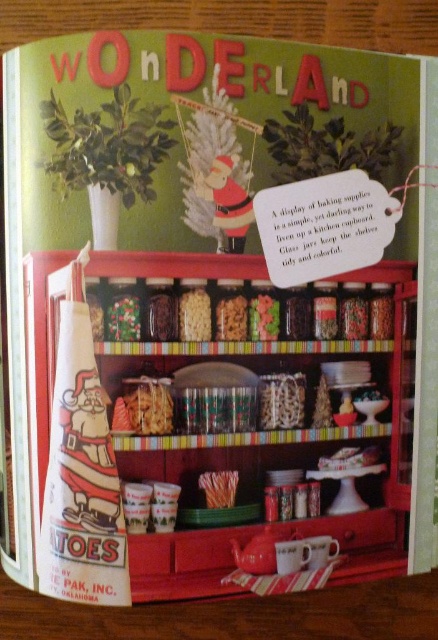
Question: Is matte glass jars at center to the left of wooden table at lower center from the viewer's perspective?

Choices:
 (A) yes
 (B) no

Answer: (B)

Question: Among these points, which one is farthest from the camera?

Choices:
 (A) (53, 282)
 (B) (152, 381)
 (C) (229, 506)
 (D) (321, 634)

Answer: (D)

Question: In this image, where is matte brown cookies at center located relative to orange textured sticks at center?

Choices:
 (A) below
 (B) above

Answer: (B)

Question: Considering the real-world distances, which object is farthest from the white matte pasta at center?

Choices:
 (A) orange textured sticks at center
 (B) wooden table at lower center
 (C) matte glass jars at center

Answer: (B)

Question: Which is farther from the white matte pasta at center?

Choices:
 (A) wooden table at lower center
 (B) translucent glass jar at center
 (C) matte glass jars at center
 (D) matte brown cookies at center

Answer: (A)

Question: Can you confirm if wooden table at lower center is positioned to the right of white matte pasta at center?

Choices:
 (A) yes
 (B) no

Answer: (A)